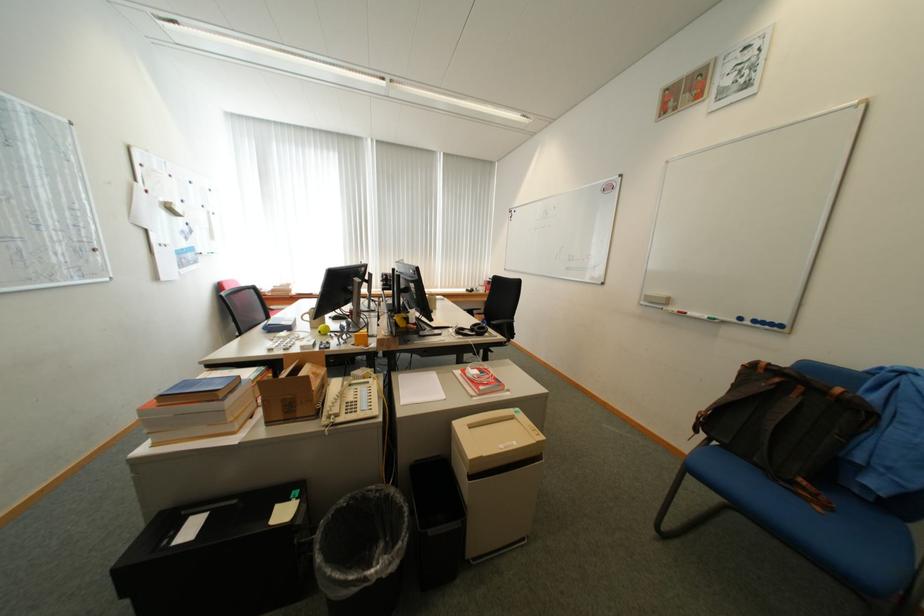
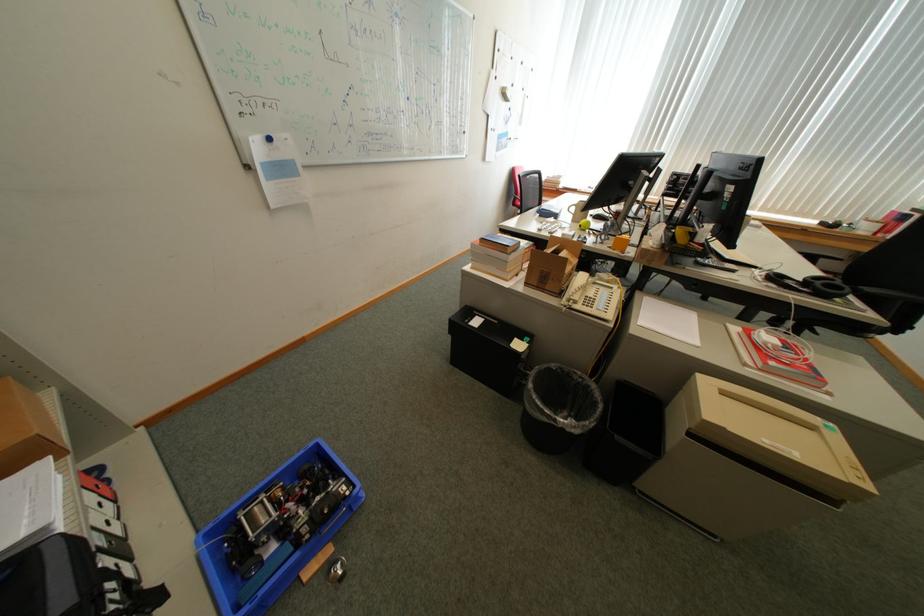
Find the pixel in the second image that matches (x=287, y=354) in the first image.

(553, 236)